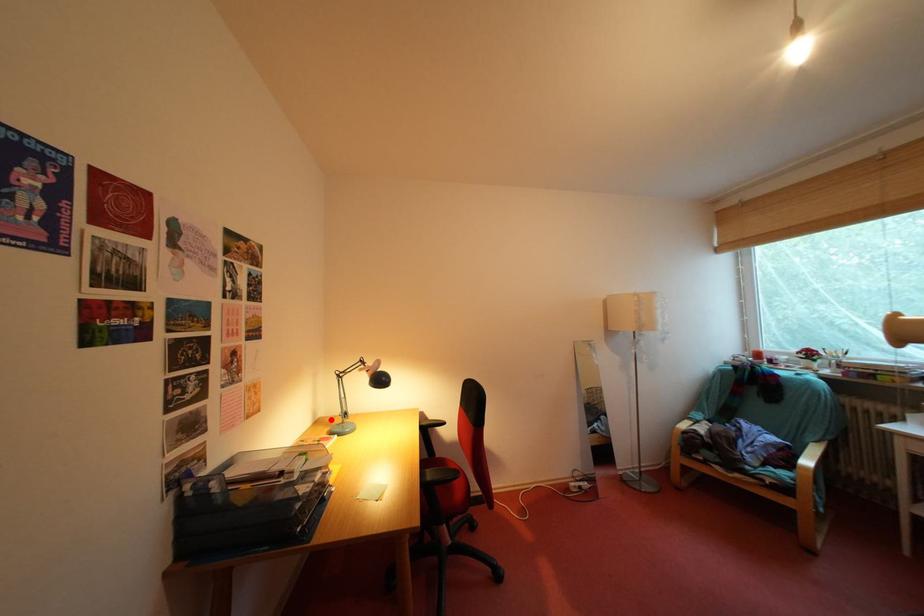
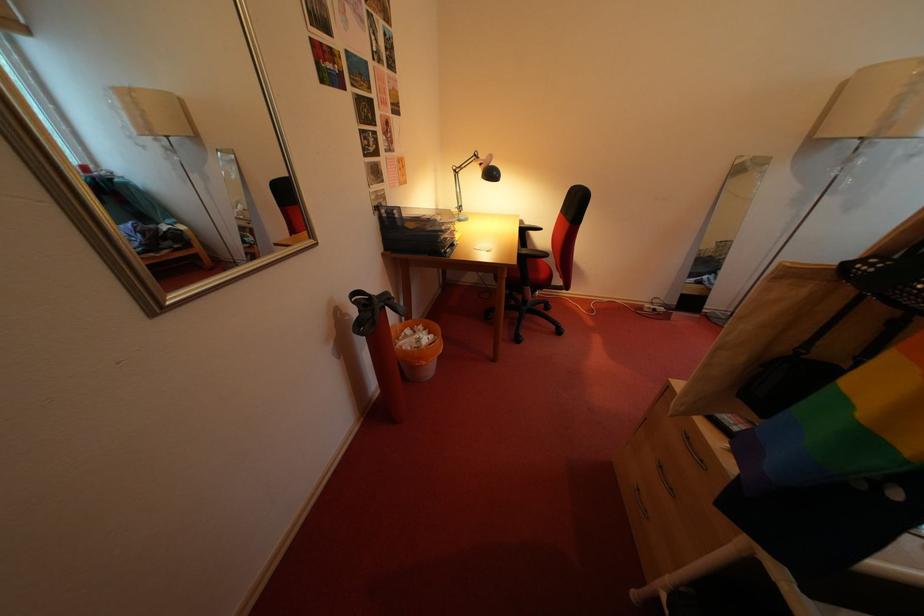
Question: I am providing you with two images of the same scene from different viewpoints. In image1, a red point is highlighted. Considering the same 3D point in image2, which of the following is correct?

Choices:
 (A) It is closer
 (B) It is farther

Answer: (A)